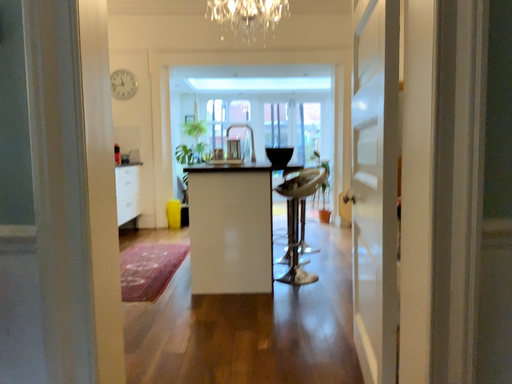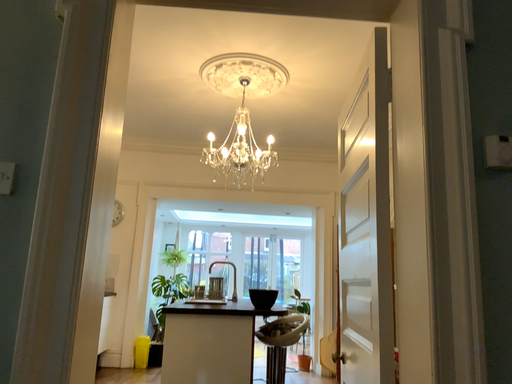
Question: How did the camera likely rotate when shooting the video?

Choices:
 (A) rotated downward
 (B) rotated upward

Answer: (B)